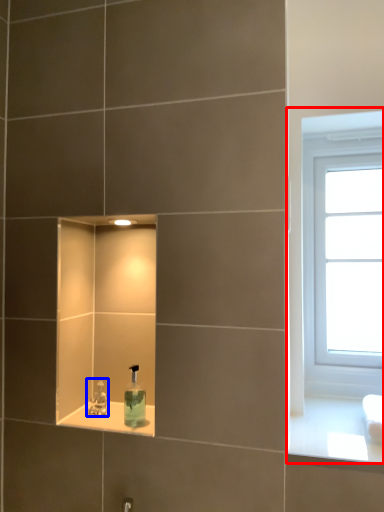
Question: Which of the following is the closest to the observer, window (highlighted by a red box) or tap (highlighted by a blue box)?

Choices:
 (A) window
 (B) tap

Answer: (B)